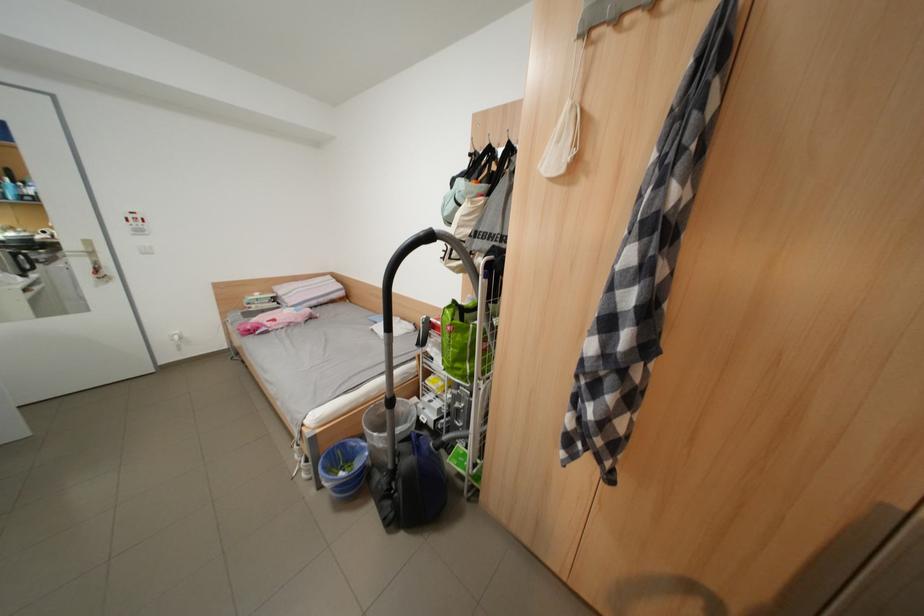
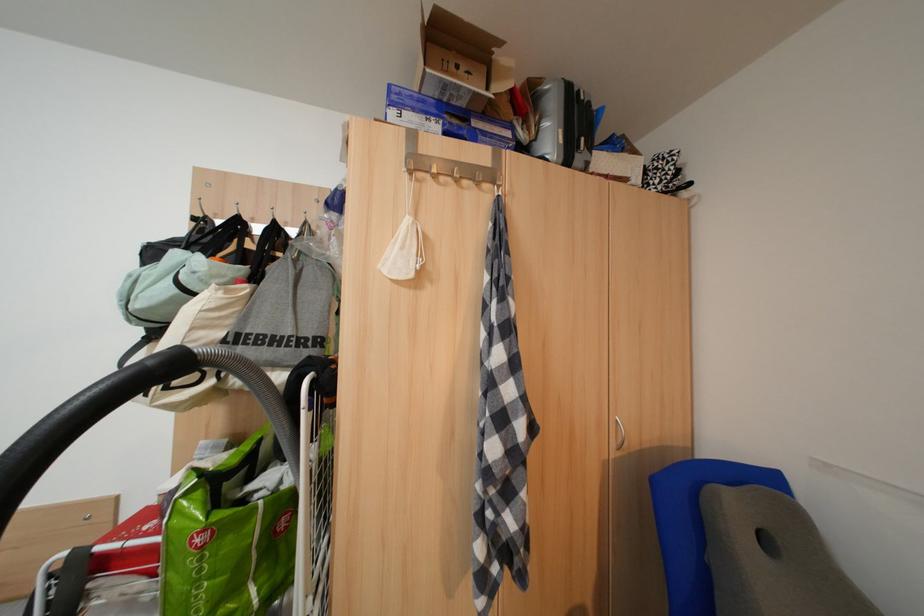
The point at (466,363) is marked in the first image. Where is the corresponding point in the second image?

(225, 610)